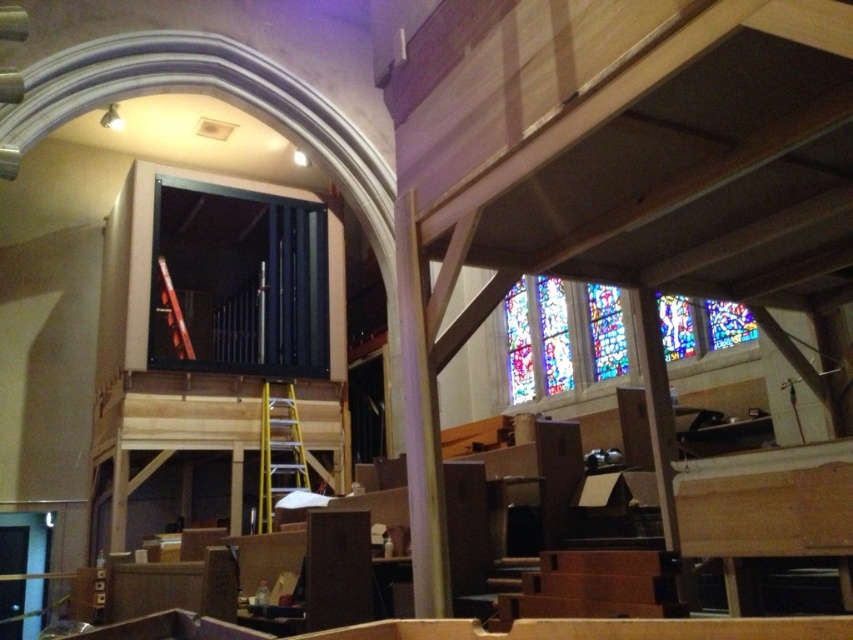
Can you confirm if yellow metallic ladder at center is positioned below metallic yellow ladder at center?

Yes.

Does point (297, 461) come farther from viewer compared to point (183, 332)?

That is False.

Which is in front, point (283, 472) or point (190, 344)?

Positioned in front is point (283, 472).

This screenshot has height=640, width=853. I want to click on yellow metallic ladder at center, so click(x=277, y=451).